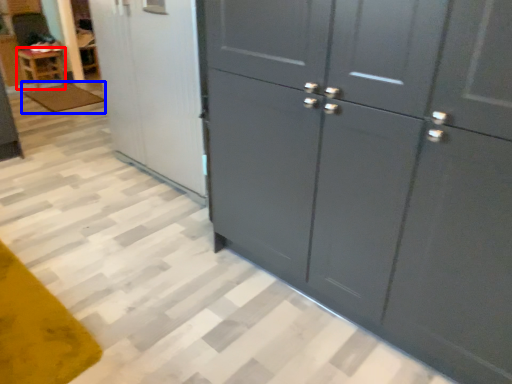
Question: Which object is closer to the camera taking this photo, furniture (highlighted by a red box) or mat (highlighted by a blue box)?

Choices:
 (A) furniture
 (B) mat

Answer: (B)